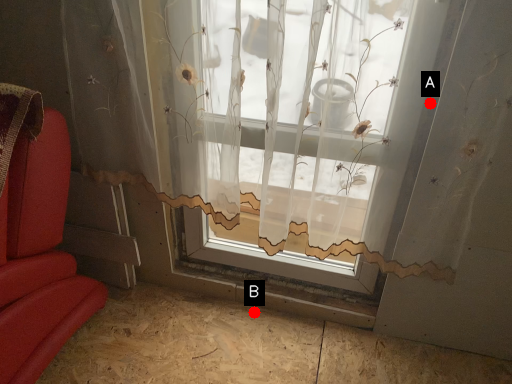
Question: Two points are circled on the image, labeled by A and B beside each circle. Which point is closer to the camera taking this photo?

Choices:
 (A) A is closer
 (B) B is closer

Answer: (A)